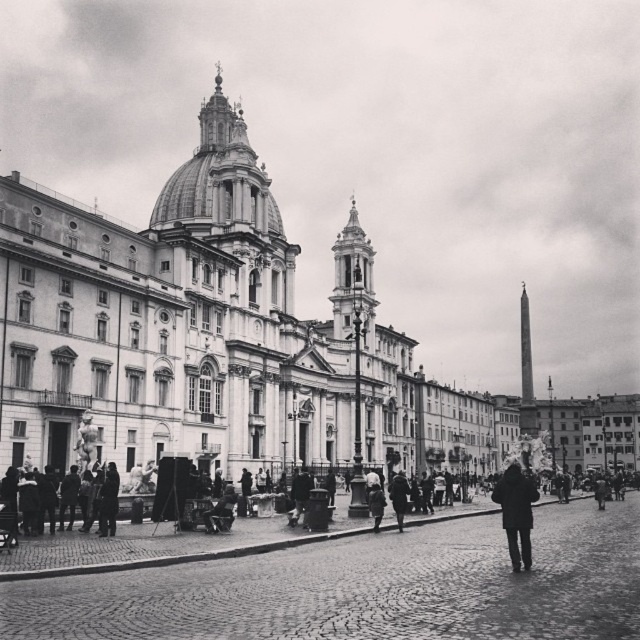
You are a tailor observing two coats in a plaza in front of a grand neoclassical building. You see the dark wool coat at lower right and the dark gray coat at lower right. Which coat would require less fabric to make?

The dark wool coat at lower right requires less fabric to make since it is thinner than the dark gray coat at lower right.

You are standing in the plaza and want to take a photo of the dark gray coat at center without the white marble palace at center appearing in the background. Which direction should you move to achieve this?

Move to the left side of the dark gray coat at center so that the white marble palace at center is no longer in the background.

You are a tourist in the square and want to find the person wearing the dark wool coat at lower right. Where should you look relative to the dark gray coat at lower right?

The dark wool coat at lower right is to the right of the dark gray coat at lower right.